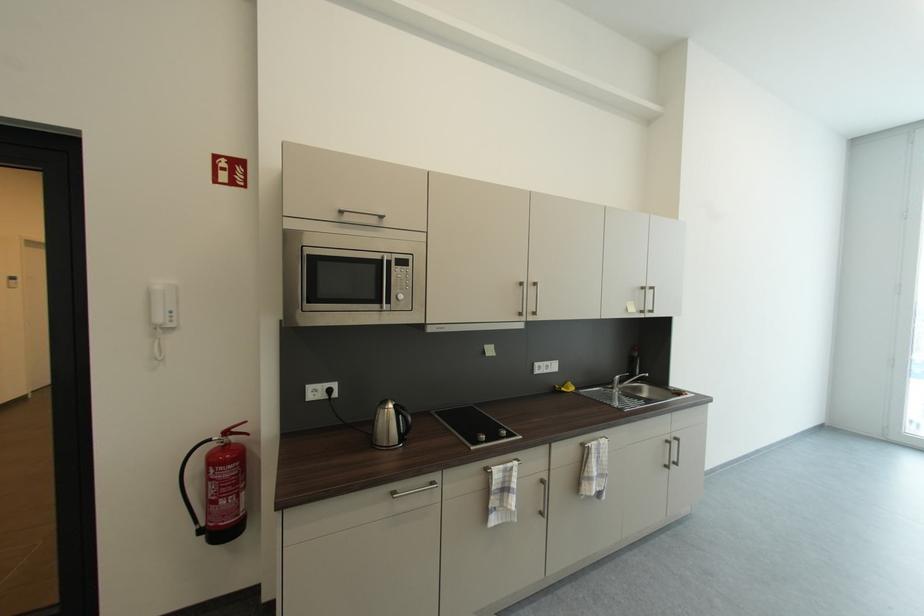
The image size is (924, 616). Find the location of `window handle`. window handle is located at coordinates (535, 298).